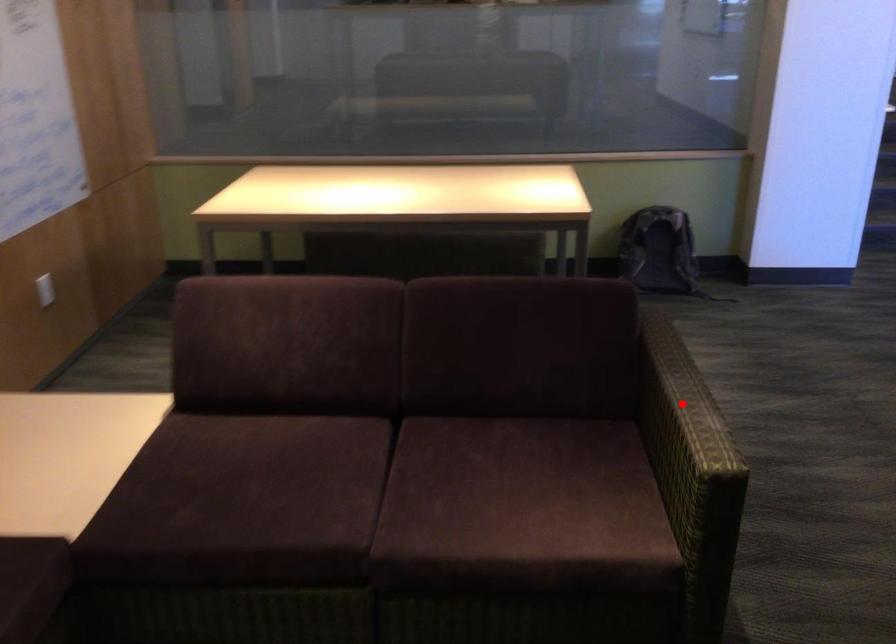
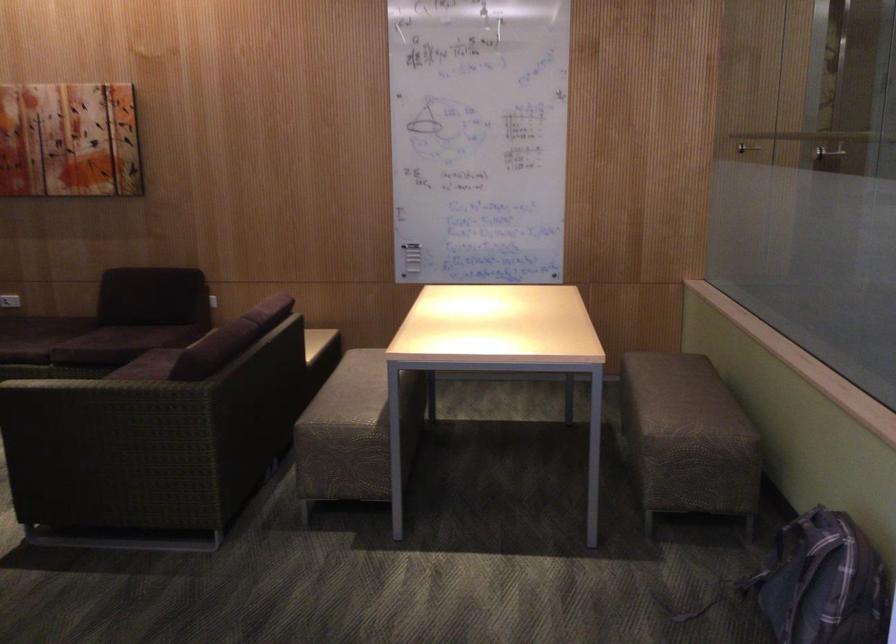
Question: I am providing you with two images of the same scene from different viewpoints. A red point is marked on the first image. Can you still see the location of the red point in image 2?

Choices:
 (A) Yes
 (B) No

Answer: (B)